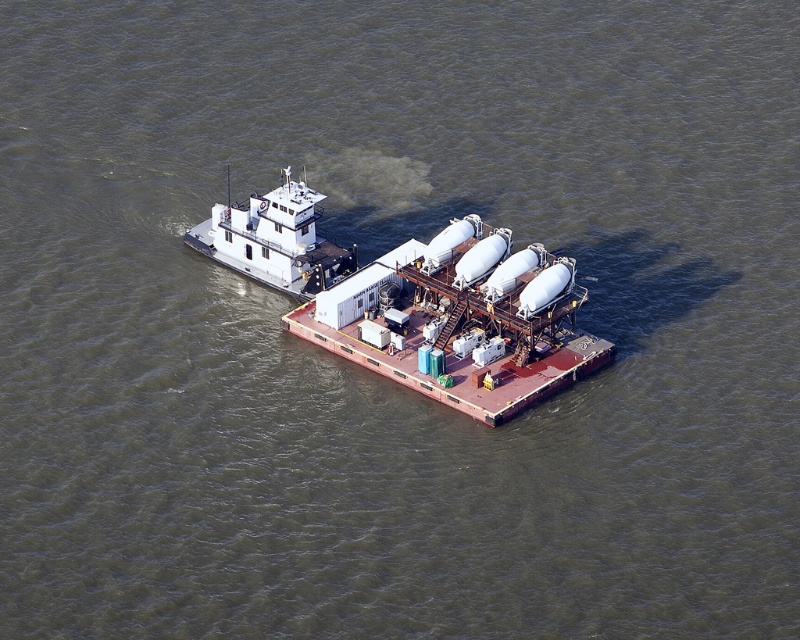
You are a drone operator flying above the barge and need to deliver a package to the control room. The control room is located at the rear of the barge. You see the white matte tankers at center and the white matte boat at center. Which object is closer to your current position so you can navigate around it?

The white matte tankers at center is closer to the viewer than the white matte boat at center, so the drone should navigate around the white matte tankers at center first as it is nearer to the current position.

You are a drone operator trying to deliver a package to the white matte tankers at center. According to the coordinates provided, where should you aim your drone to ensure it reaches the correct location?

The white matte tankers at center are located at point coordinates of (x=460, y=321). Aim your drone at those coordinates to deliver the package.

In the scene shown: You are a drone operator flying at an altitude of 120 meters above the barge. Your drone has a camera with a maximum zoom range of 100 meters. Can your drone capture a clear image of the white matte tankers at center from its current position?

The distance of white matte tankers at center from camera is 101.07 meters, which exceeds the drone camera maximum zoom range of 100 meters. Therefore, the drone cannot capture a clear image of the white matte tankers at center from its current position.